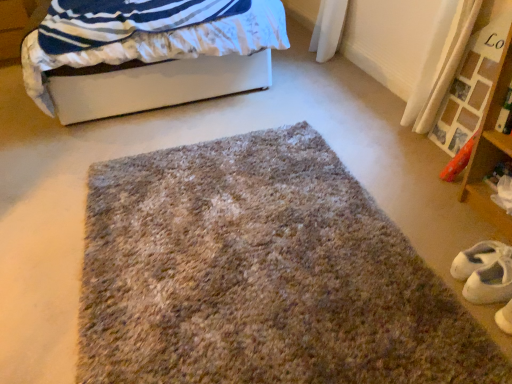
Locate an element on the screen. free space to the left of white suede shoe at lower right is located at coordinates (424, 283).